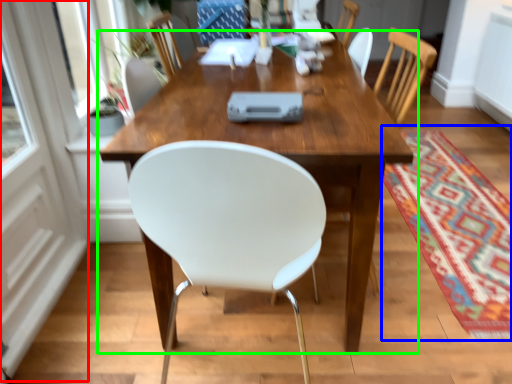
Question: Which object is the farthest from screen door (highlighted by a red box)? Choose among these: mat (highlighted by a blue box) or table (highlighted by a green box).

Choices:
 (A) mat
 (B) table

Answer: (A)